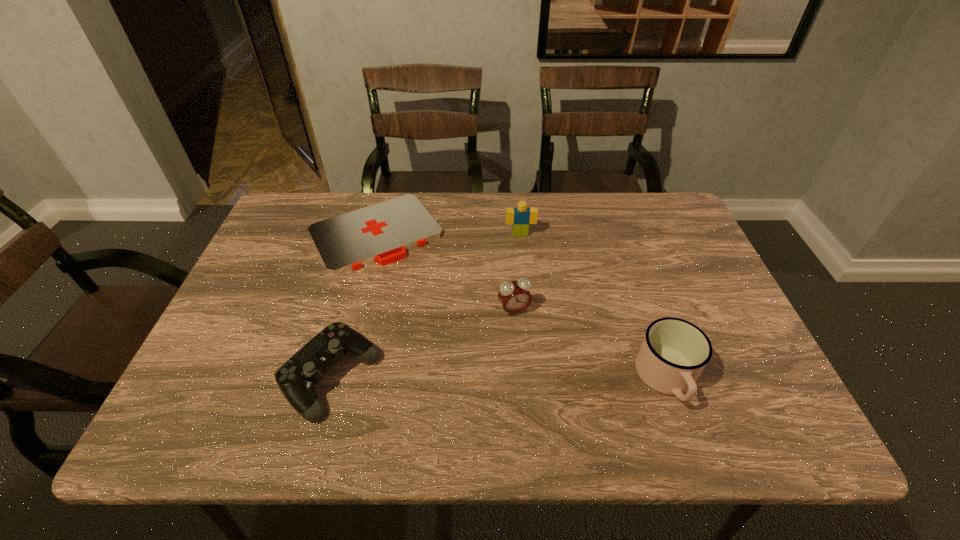
Find the location of a particular element. The height and width of the screenshot is (540, 960). free point between the shortest object and the Lego is located at coordinates (448, 234).

Find the location of a particular element. vacant point located between the Lego and the third nearest object is located at coordinates (517, 272).

Identify the location of free space between the alarm clock and the Lego. The width and height of the screenshot is (960, 540). coord(517,272).

I want to click on free space between the alarm clock and the fourth tallest object, so click(x=422, y=345).

The height and width of the screenshot is (540, 960). I want to click on vacant area that lies between the third farthest object and the control, so click(x=422, y=345).

Locate an element on the screen. The height and width of the screenshot is (540, 960). vacant space that's between the Lego and the second shortest object is located at coordinates click(x=425, y=307).

Where is `free space between the mug and the Lego`? The width and height of the screenshot is (960, 540). free space between the mug and the Lego is located at coordinates (593, 307).

Locate an element on the screen. The width and height of the screenshot is (960, 540). the third closest object relative to the second shortest object is located at coordinates (520, 217).

Select which object is the closest to the shortest object. Please provide its 2D coordinates. Your answer should be formatted as a tuple, i.e. [(x, y)], where the tuple contains the x and y coordinates of a point satisfying the conditions above.

[(514, 296)]